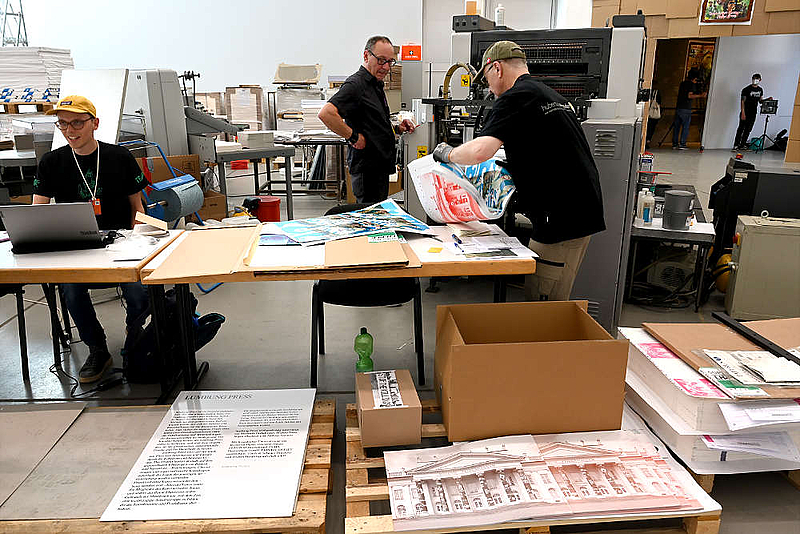
The image size is (800, 534). In order to click on cardboard box in this screenshot , I will do `click(546, 386)`, `click(397, 424)`, `click(700, 335)`.